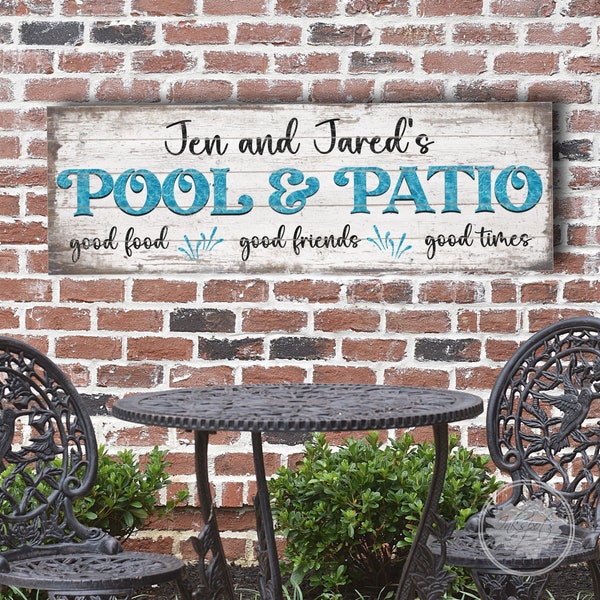
You are a GUI agent. You are given a task and a screenshot of the screen. Output one action in this format:
    pyautogui.click(x=<x>, y=<y>)
    Task: Click on the tabl;e
    The height and width of the screenshot is (600, 600).
    Given the screenshot: What is the action you would take?
    pyautogui.click(x=383, y=414)